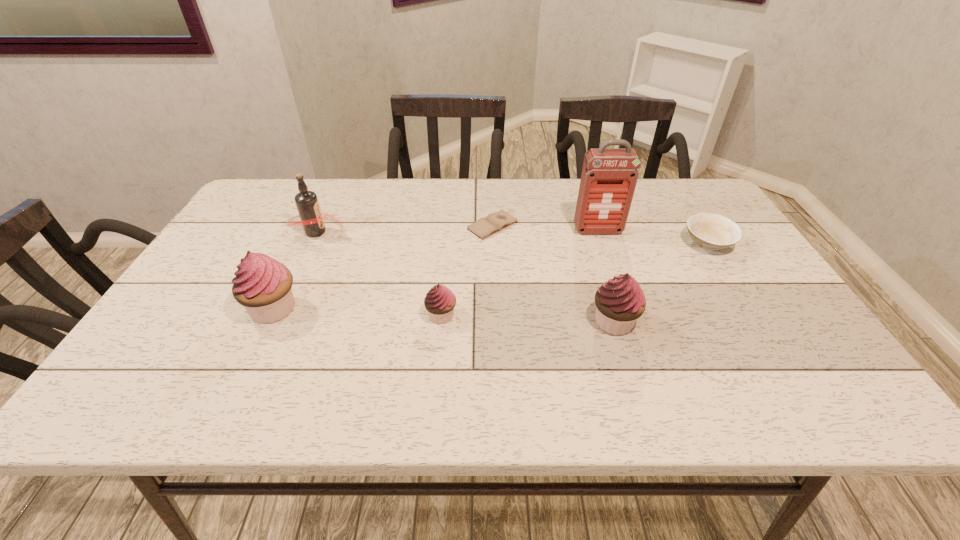
Locate an element on the screen. This screenshot has height=540, width=960. bowl is located at coordinates (709, 231).

This screenshot has height=540, width=960. What are the coordinates of `vacant space situated 0.170m on the back of the leftmost cupcake` in the screenshot? It's located at (303, 248).

Where is `vacant region located 0.160m on the left of the shortest cupcake`? This screenshot has height=540, width=960. vacant region located 0.160m on the left of the shortest cupcake is located at coordinates (357, 315).

I want to click on vacant space located 0.070m on the right of the rightmost cupcake, so click(668, 322).

Identify the location of vacant point located 0.220m on the front-facing side of the tallest object. The image size is (960, 540). click(617, 289).

The width and height of the screenshot is (960, 540). I want to click on free region located on the front of the fourth object from right to left, so click(496, 339).

Locate an element on the screen. Image resolution: width=960 pixels, height=540 pixels. blank area located 0.310m on the label of the root beer is located at coordinates (452, 232).

Locate an element on the screen. The image size is (960, 540). vacant space located 0.330m on the front of the bowl is located at coordinates (780, 360).

The height and width of the screenshot is (540, 960). Find the location of `diary that is at the far edge`. diary that is at the far edge is located at coordinates (484, 227).

Image resolution: width=960 pixels, height=540 pixels. In order to click on root beer present at the far edge in this screenshot , I will do `click(312, 219)`.